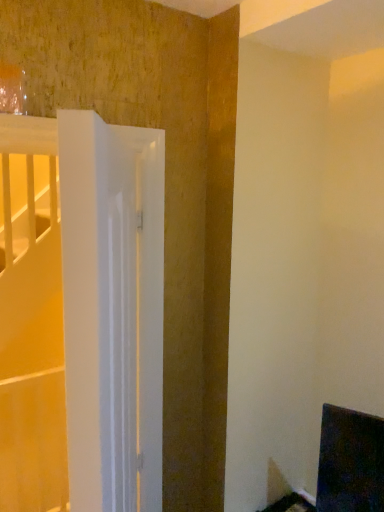
The height and width of the screenshot is (512, 384). In order to click on white glossy door at left in this screenshot , I will do `click(112, 311)`.

The height and width of the screenshot is (512, 384). What do you see at coordinates (112, 311) in the screenshot?
I see `white glossy door at left` at bounding box center [112, 311].

I want to click on white glossy door at left, so click(x=112, y=311).